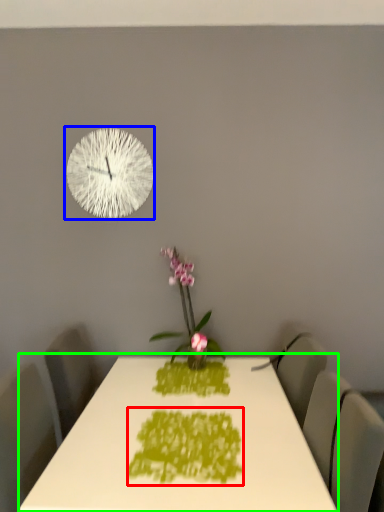
Question: Which object is positioned closest to design (highlighted by a red box)? Select from wall clock (highlighted by a blue box) and table (highlighted by a green box).

Choices:
 (A) wall clock
 (B) table

Answer: (B)